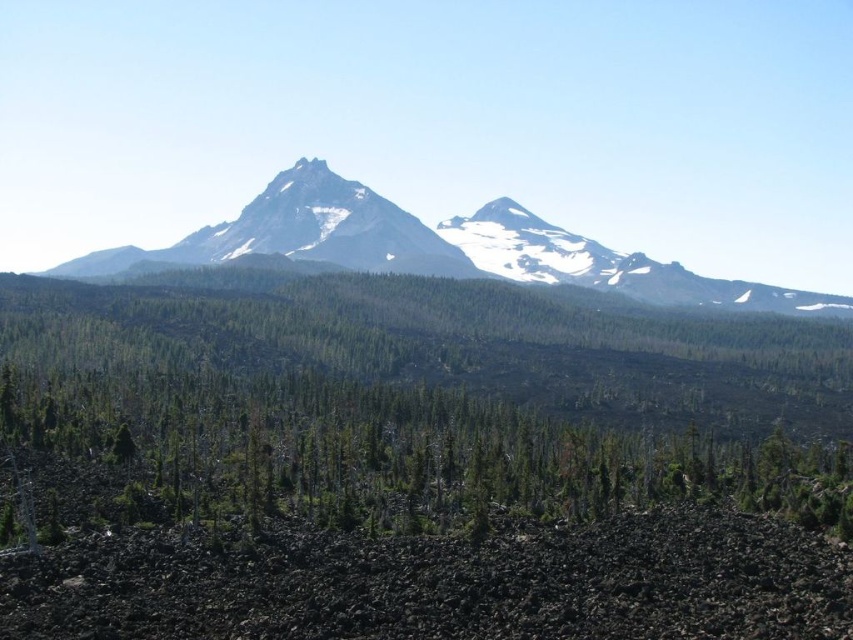
You are an environmental scientist studying the landscape. You need to determine which object takes up more visual space in the image between the green matte tree at center and the snowy granite mountain range at center. Which one is it?

The snowy granite mountain range at center occupies more visual space than the green matte tree at center according to the description.

You are a hiker planning to take a photo of the snowy granite mountain range at center from the green matte tree at center. Will the tree block your view of the mountain range?

The green matte tree at center is positioned under the snowy granite mountain range at center, so the tree will block your view of the mountain range.